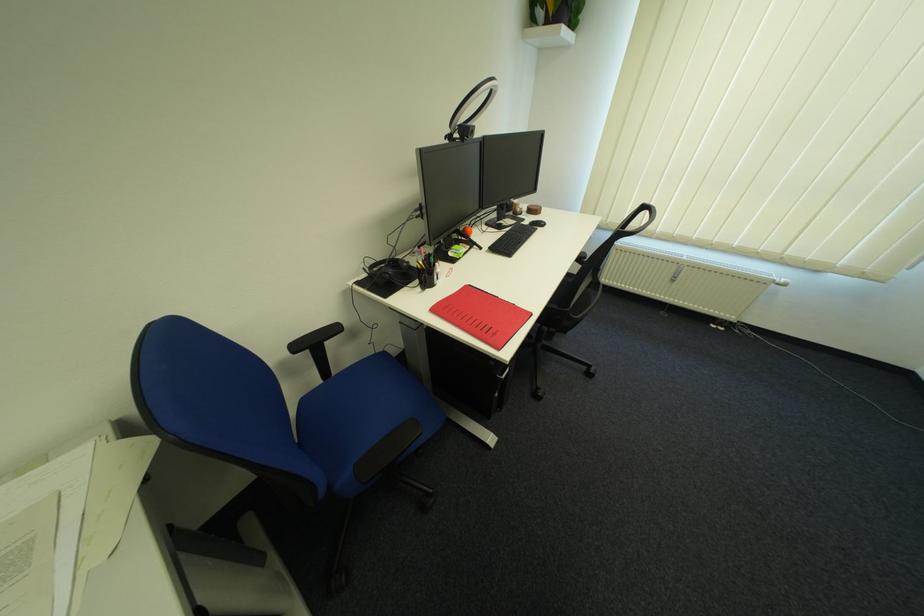
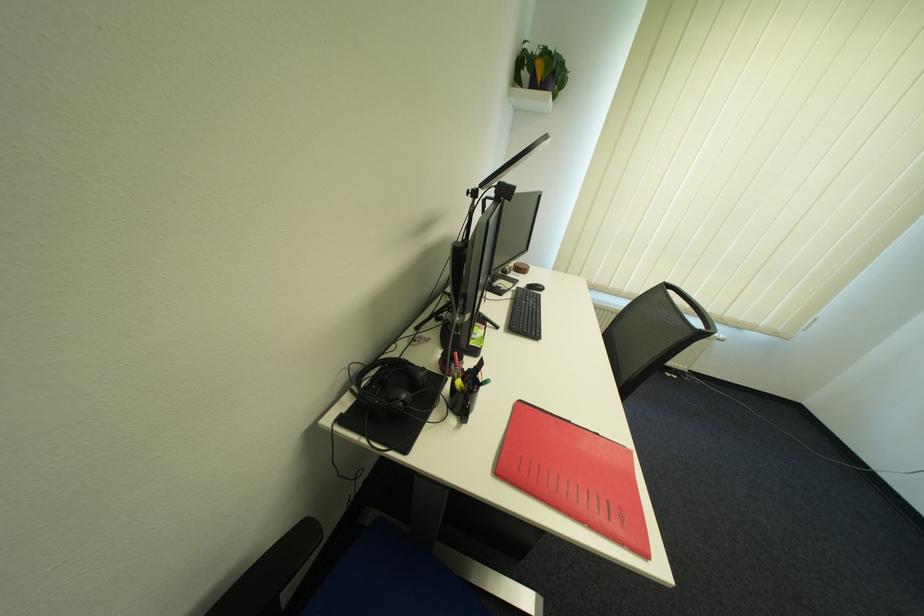
In a continuous first-person perspective shot, in which direction is the camera moving?

The movement direction of the cameraman is left, forward.